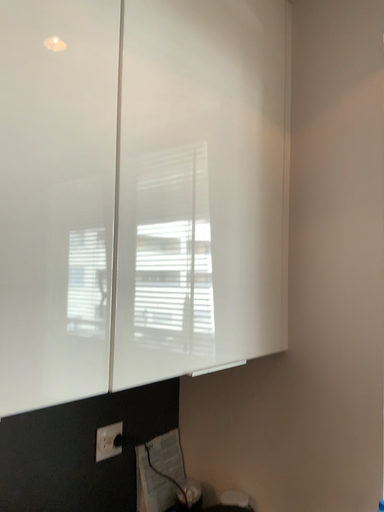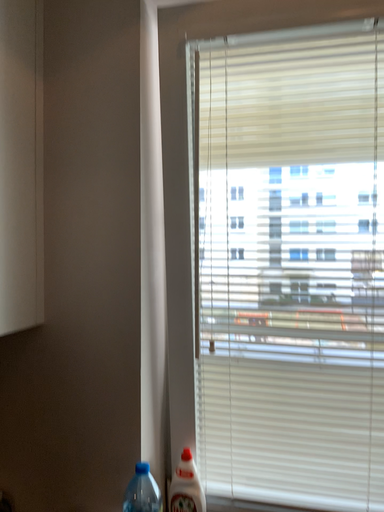
Question: Which way did the camera rotate in the video?

Choices:
 (A) rotated left
 (B) rotated right

Answer: (B)